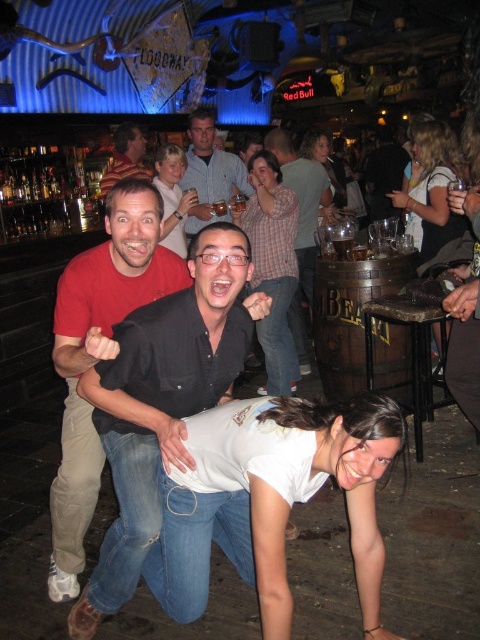
Question: Is black shirt at center to the left of matte black shirt at center from the viewer's perspective?

Choices:
 (A) no
 (B) yes

Answer: (A)

Question: Does matte red shirt at center have a smaller size compared to striped shirt at upper left?

Choices:
 (A) no
 (B) yes

Answer: (A)

Question: Can you confirm if matte red shirt at center is positioned to the left of matte plaid shirt at center?

Choices:
 (A) yes
 (B) no

Answer: (A)

Question: Which is farther from the matte black shirt at center?

Choices:
 (A) light blue shirt at center
 (B) plaid shirt at center
 (C) matte red shirt at center
 (D) matte plaid shirt at center

Answer: (C)

Question: Among these points, which one is nearest to the camera?

Choices:
 (A) (180, 220)
 (B) (235, 188)
 (C) (97, 436)
 (D) (387, 145)

Answer: (C)

Question: Which object is farther from the camera taking this photo?

Choices:
 (A) light blue shirt at center
 (B) blonde hair at upper right

Answer: (A)